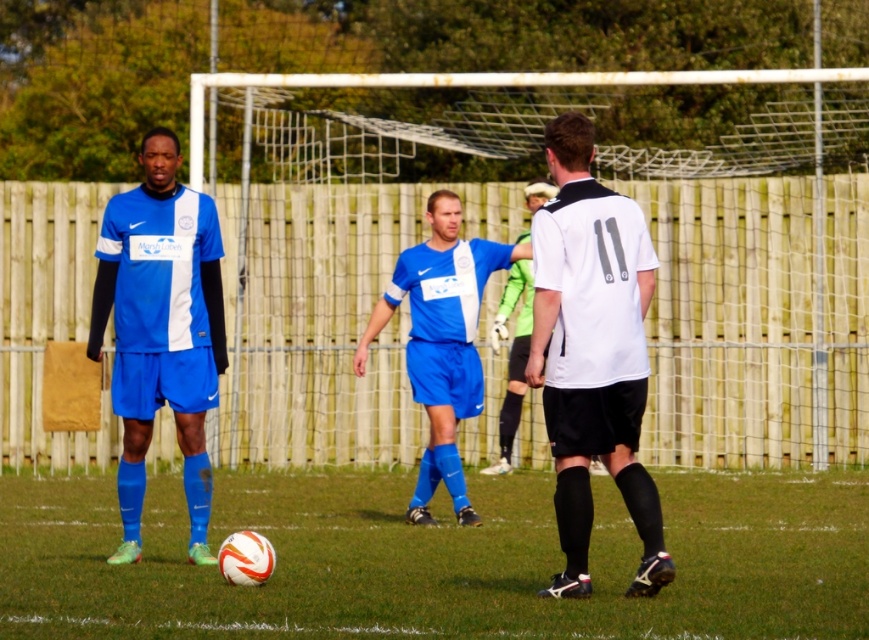
Is point (187, 403) farther from viewer compared to point (522, 394)?

No.

At what (x,y) coordinates should I click in order to perform the action: click on matte blue jersey at left. Please return your answer as a coordinate pair (x, y). The width and height of the screenshot is (869, 640). Looking at the image, I should click on (161, 330).

What are the coordinates of `matte blue jersey at left` in the screenshot? It's located at (161, 330).

Who is taller, white matte soccer ball at center or matte blue jersey at center?

Standing taller between the two is matte blue jersey at center.

At what (x,y) coordinates should I click in order to perform the action: click on white matte soccer ball at center. Please return your answer as a coordinate pair (x, y). Image resolution: width=869 pixels, height=640 pixels. Looking at the image, I should click on (436, 557).

The width and height of the screenshot is (869, 640). I want to click on white matte soccer ball at center, so click(x=436, y=557).

Is white matte soccer ball at center bigger than white matte jersey at center?

Yes, white matte soccer ball at center is bigger than white matte jersey at center.

Who is more forward, (854,634) or (556,243)?

Point (854,634) is in front.

Where is `white matte soccer ball at center`? The width and height of the screenshot is (869, 640). white matte soccer ball at center is located at coordinates (436, 557).

What are the coordinates of `white matte soccer ball at center` in the screenshot? It's located at (436, 557).